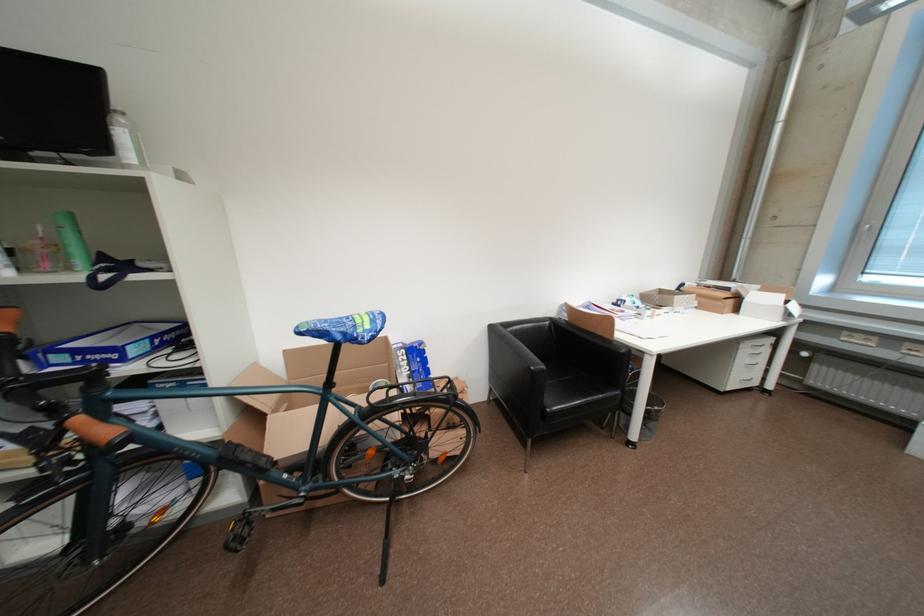
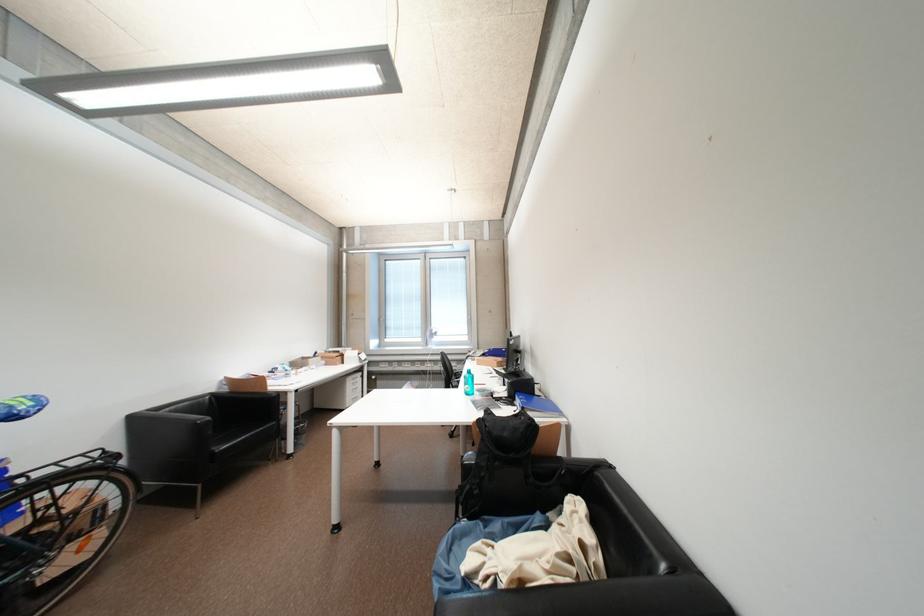
In the second image, find the point that corresponds to point (754, 352) in the first image.

(358, 384)